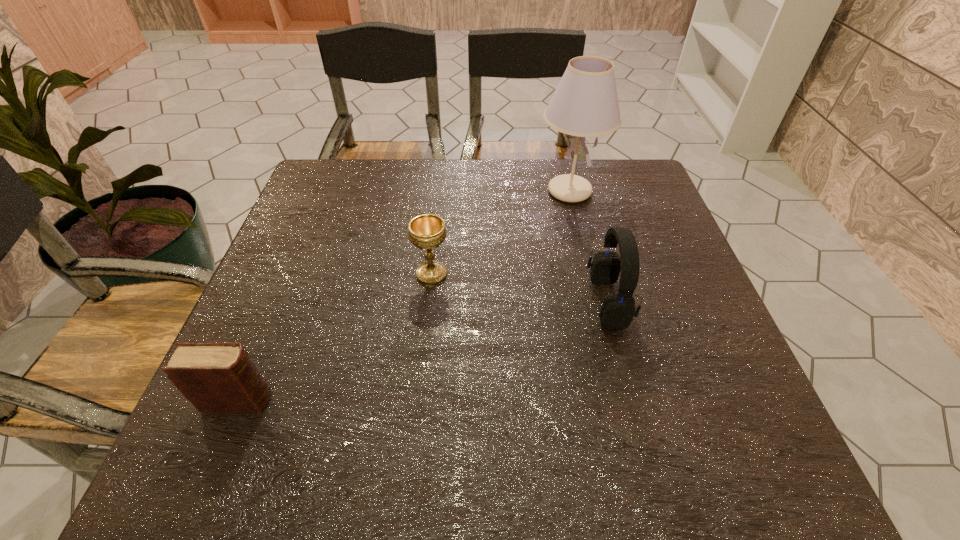
This screenshot has width=960, height=540. Find the location of `unoccupied position between the diary and the third object from right to left`. unoccupied position between the diary and the third object from right to left is located at coordinates tap(335, 338).

Image resolution: width=960 pixels, height=540 pixels. What are the coordinates of `free space between the third shortest object and the diary` in the screenshot? It's located at (423, 351).

This screenshot has width=960, height=540. I want to click on free space that is in between the second object from left to right and the nearest object, so click(335, 338).

The width and height of the screenshot is (960, 540). What are the coordinates of `object that is the third closest one to the nearest object` in the screenshot? It's located at (585, 104).

Select which object is the third closest to the headset. Please provide its 2D coordinates. Your answer should be formatted as a tuple, i.e. [(x, y)], where the tuple contains the x and y coordinates of a point satisfying the conditions above.

[(215, 377)]

This screenshot has height=540, width=960. Identify the location of vacant space that satisfies the following two spatial constraints: 1. on the front side of the chalice; 2. on the spine side of the nearest object. (419, 401).